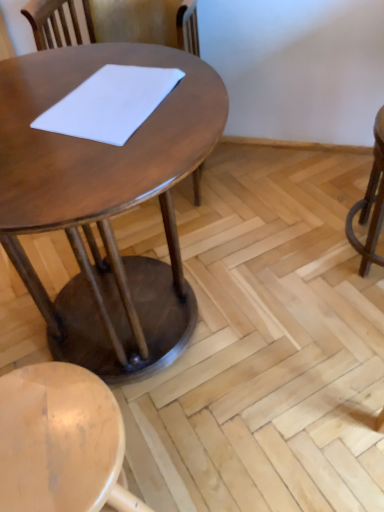
Image resolution: width=384 pixels, height=512 pixels. I want to click on free space above light wood stool at lower left (from a real-world perspective), so click(53, 434).